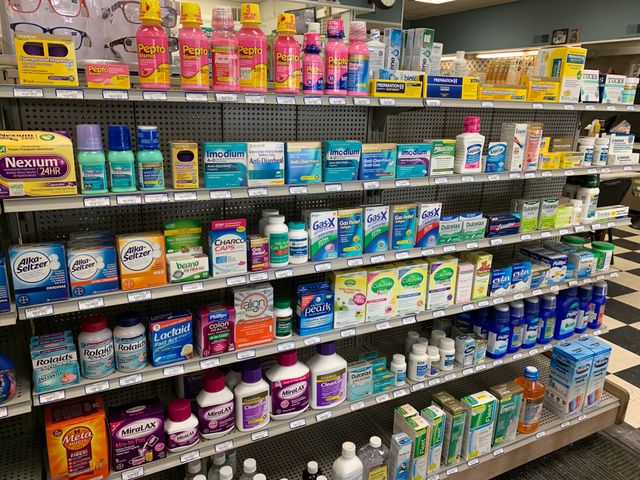
At what (x,y) coordinates should I click in order to perform the action: click on bottom shelf. Please return your answer as a coordinate pair (x, y). The height and width of the screenshot is (480, 640). Looking at the image, I should click on (306, 446), (600, 403).